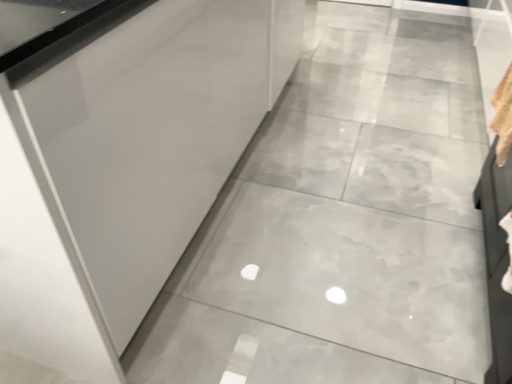
Where is `glossy white glass door at upper left`? The height and width of the screenshot is (384, 512). glossy white glass door at upper left is located at coordinates (140, 137).

What do you see at coordinates (140, 137) in the screenshot? I see `glossy white glass door at upper left` at bounding box center [140, 137].

Where is `glossy white glass door at upper left`? glossy white glass door at upper left is located at coordinates (140, 137).